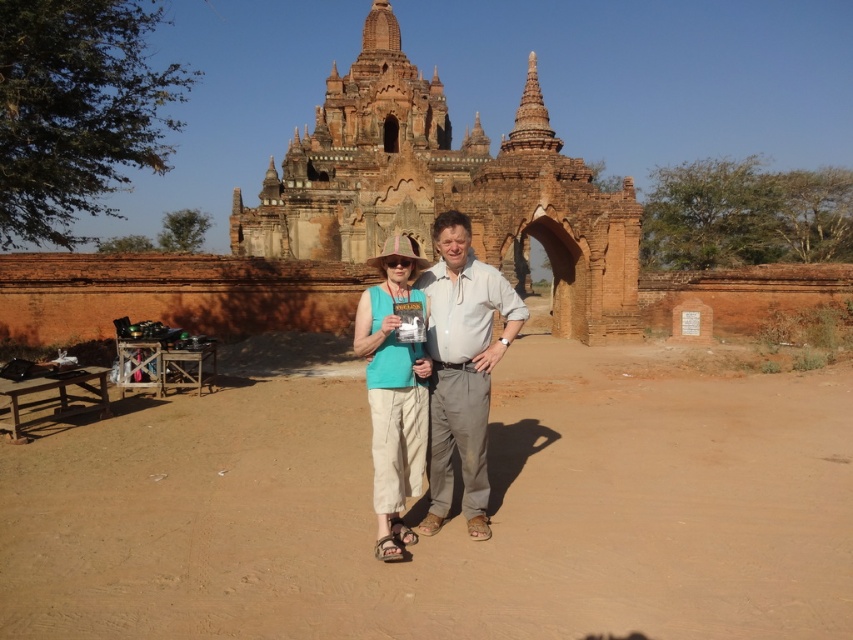
Does brown dirt track at center have a lesser height compared to reddish-brown stone temple at center?

Indeed, brown dirt track at center has a lesser height compared to reddish-brown stone temple at center.

Between point (335, 544) and point (329, 141), which one is positioned in front?

Point (335, 544) is in front.

Image resolution: width=853 pixels, height=640 pixels. Describe the element at coordinates (451, 516) in the screenshot. I see `brown dirt track at center` at that location.

Where is `brown dirt track at center`? The image size is (853, 640). brown dirt track at center is located at coordinates (451, 516).

Is matte teal tank top at center in front of matte teal shirt at center?

That is False.

Is matte teal tank top at center further to the viewer compared to matte teal shirt at center?

Yes, matte teal tank top at center is further from the viewer.

Who is more forward, (427, 316) or (370, 289)?

Positioned in front is point (427, 316).

Locate an element on the screen. The height and width of the screenshot is (640, 853). matte teal tank top at center is located at coordinates (462, 368).

Is the position of reddish-brown stone temple at center more distant than that of matte teal tank top at center?

Yes, reddish-brown stone temple at center is further from the viewer.

Does point (488, 168) come closer to viewer compared to point (473, 328)?

No.

Identify the location of reddish-brown stone temple at center. (445, 188).